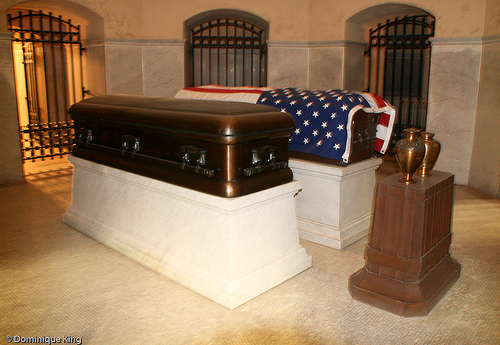
Find the location of a particular element. This screenshot has height=345, width=500. floor is located at coordinates (84, 285).